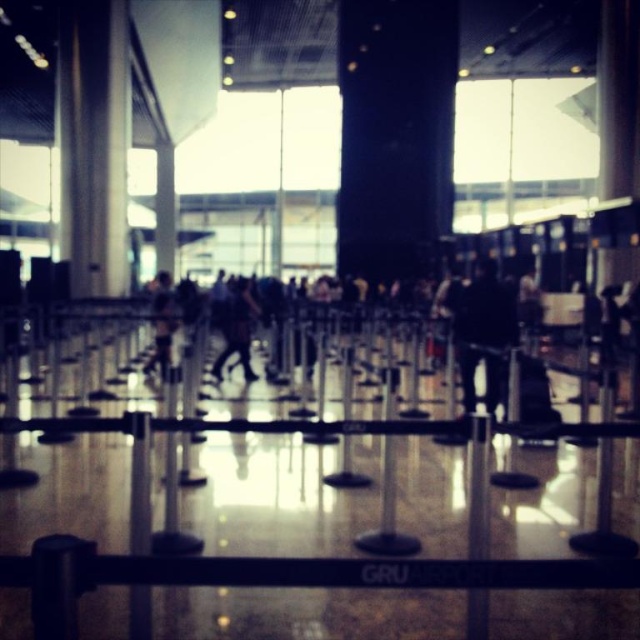
You are standing in the airport terminal and notice a dark gray fabric bag at center and dark blue jeans at center. Which object is positioned lower in the scene?

The dark gray fabric bag at center is positioned below the dark blue jeans at center, so it is lower in the scene.

You are a traveler standing in the airport terminal and notice a dark gray fabric bag at center and dark blue jeans at center near the queue line. Which item takes up more space in the area?

The dark blue jeans at center takes up more space than the dark gray fabric bag at center because the dark gray fabric bag at center occupies less space than dark blue jeans at center.